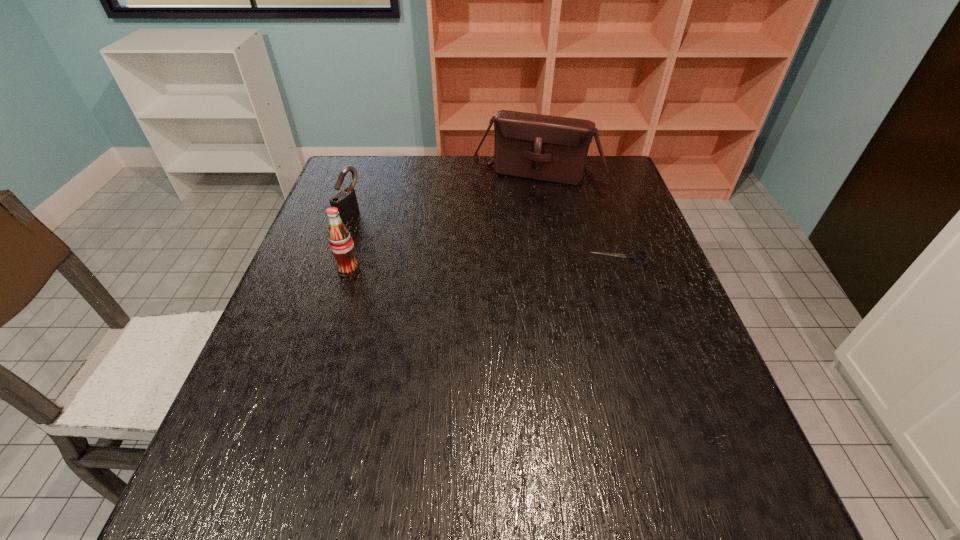
Identify the location of vacant space located on the front flap of the farthest object. (516, 214).

Locate an element on the screen. The width and height of the screenshot is (960, 540). vacant region located on the front flap of the farthest object is located at coordinates (498, 265).

Where is `free space located 0.190m on the front flap of the farthest object`? Image resolution: width=960 pixels, height=540 pixels. free space located 0.190m on the front flap of the farthest object is located at coordinates (511, 227).

Where is `object that is at the far edge`? object that is at the far edge is located at coordinates (549, 148).

The height and width of the screenshot is (540, 960). What are the coordinates of `soda that is positioned at the left edge` in the screenshot? It's located at pyautogui.click(x=341, y=244).

Image resolution: width=960 pixels, height=540 pixels. Find the location of `padlock that is at the left edge`. padlock that is at the left edge is located at coordinates (345, 201).

You are a GUI agent. You are given a task and a screenshot of the screen. Output one action in this format:
    pyautogui.click(x=<x>, y=<y>)
    Task: Click on the shears located at the right edge
    This screenshot has height=540, width=960.
    Given the screenshot: What is the action you would take?
    pyautogui.click(x=633, y=256)

This screenshot has height=540, width=960. What are the coordinates of `shoulder bag at the right edge` in the screenshot? It's located at (549, 148).

Where is `object that is at the far right corner`? This screenshot has width=960, height=540. object that is at the far right corner is located at coordinates [549, 148].

In order to click on vacant area at the far edge in this screenshot , I will do `click(402, 160)`.